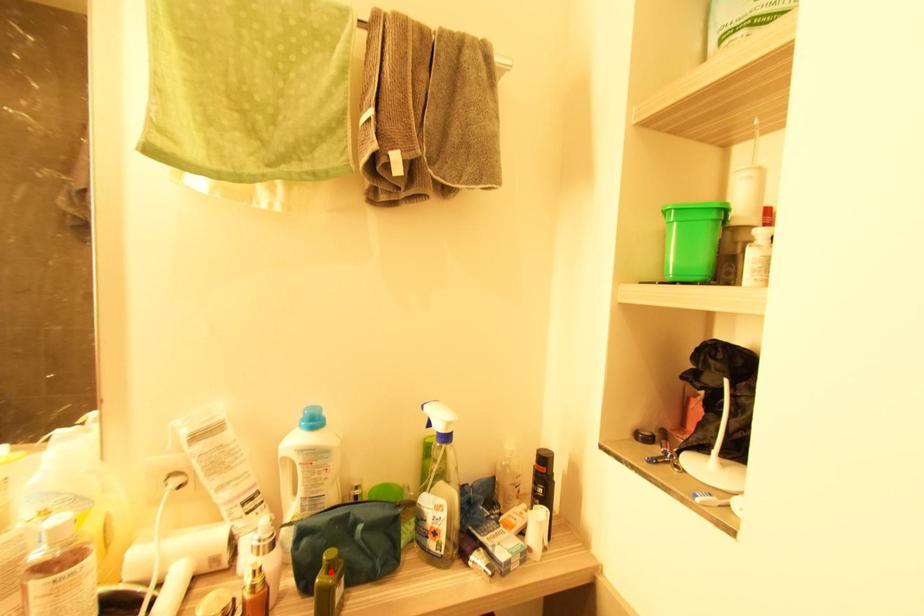
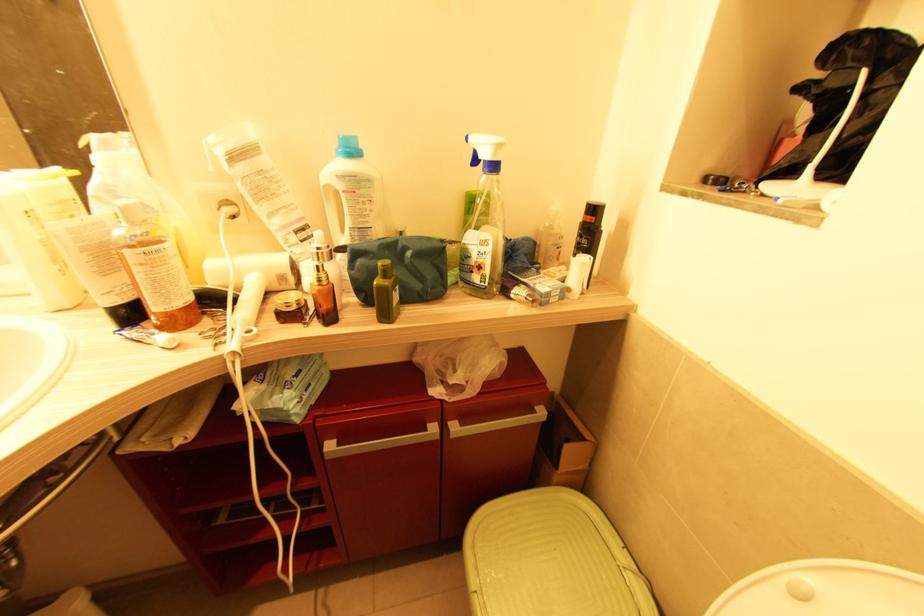
Where in the second image is the point corresponding to the highlighted location from the first image?

(386, 278)